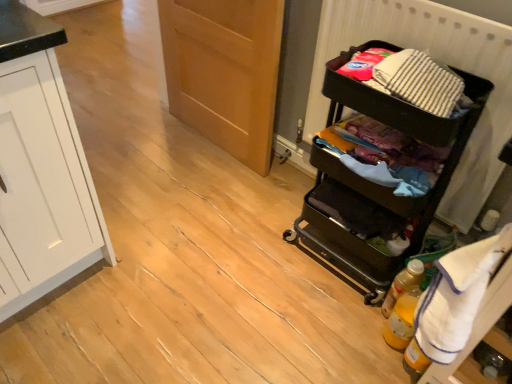
Question: Can you confirm if white terry cloth towel at right is shorter than translucent yellow bottle at lower right, marked as the second bottle in a front-to-back arrangement?

Choices:
 (A) yes
 (B) no

Answer: (B)

Question: Can you confirm if white terry cloth towel at right is positioned to the right of translucent yellow bottle at lower right, marked as the second bottle in a front-to-back arrangement?

Choices:
 (A) yes
 (B) no

Answer: (A)

Question: Would you consider white terry cloth towel at right to be distant from translucent yellow bottle at lower right, marked as the second bottle in a front-to-back arrangement?

Choices:
 (A) yes
 (B) no

Answer: (B)

Question: Is white terry cloth towel at right looking in the opposite direction of translucent yellow bottle at lower right, the first bottle viewed from the back?

Choices:
 (A) no
 (B) yes

Answer: (A)

Question: Is white terry cloth towel at right smaller than translucent yellow bottle at lower right, the first bottle viewed from the back?

Choices:
 (A) yes
 (B) no

Answer: (B)

Question: In terms of size, does translucent yellow bottle at lower right, arranged as the 2th bottle when viewed from the back, appear bigger or smaller than white terry cloth towel at right?

Choices:
 (A) small
 (B) big

Answer: (A)

Question: Considering the positions of translucent yellow bottle at lower right, arranged as the 2th bottle when viewed from the back, and white terry cloth towel at right in the image, is translucent yellow bottle at lower right, arranged as the 2th bottle when viewed from the back, wider or thinner than white terry cloth towel at right?

Choices:
 (A) wide
 (B) thin

Answer: (B)

Question: From a real-world perspective, is translucent yellow bottle at lower right, arranged as the 2th bottle when viewed from the back, physically located above or below white terry cloth towel at right?

Choices:
 (A) below
 (B) above

Answer: (A)

Question: Do you think translucent yellow bottle at lower right, arranged as the 2th bottle when viewed from the back, is within white terry cloth towel at right, or outside of it?

Choices:
 (A) outside
 (B) inside

Answer: (A)

Question: Considering the positions of point (408, 326) and point (203, 74), is point (408, 326) closer or farther from the camera than point (203, 74)?

Choices:
 (A) farther
 (B) closer

Answer: (B)

Question: In terms of height, does translucent yellow bottle at lower right, placed as the first bottle when sorted from front to back, look taller or shorter compared to wooden door at center?

Choices:
 (A) short
 (B) tall

Answer: (A)

Question: Is translucent yellow bottle at lower right, placed as the first bottle when sorted from front to back, inside or outside of wooden door at center?

Choices:
 (A) inside
 (B) outside

Answer: (B)

Question: From the image's perspective, is translucent yellow bottle at lower right, arranged as the 2th bottle when viewed from the back, above or below wooden door at center?

Choices:
 (A) below
 (B) above

Answer: (A)

Question: In the image, is white terry cloth towel at right on the left side or the right side of translucent yellow bottle at lower right, arranged as the 2th bottle when viewed from the back?

Choices:
 (A) left
 (B) right

Answer: (B)

Question: From the image's perspective, relative to translucent yellow bottle at lower right, placed as the first bottle when sorted from front to back, is white terry cloth towel at right above or below?

Choices:
 (A) below
 (B) above

Answer: (B)